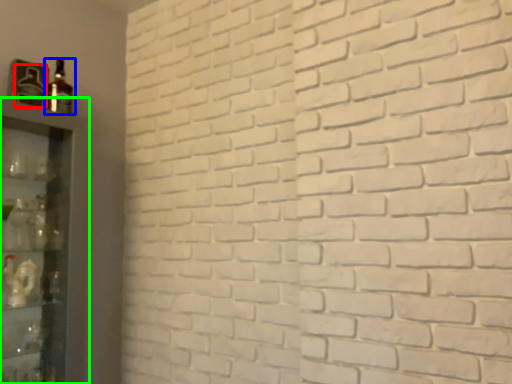
Question: Based on their relative distances, which object is farther from bottle (highlighted by a red box)? Choose from bottle (highlighted by a blue box) and shelf (highlighted by a green box).

Choices:
 (A) bottle
 (B) shelf

Answer: (B)